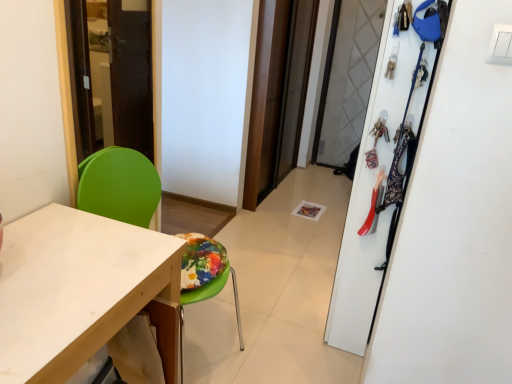
Question: Is white matte desk at lower left placed right next to white matte closet at upper right?

Choices:
 (A) no
 (B) yes

Answer: (A)

Question: From a real-world perspective, is white matte desk at lower left under white matte closet at upper right?

Choices:
 (A) yes
 (B) no

Answer: (A)

Question: Considering the relative positions of white matte desk at lower left and white matte closet at upper right in the image provided, is white matte desk at lower left to the left of white matte closet at upper right from the viewer's perspective?

Choices:
 (A) no
 (B) yes

Answer: (B)

Question: Considering the relative sizes of white matte desk at lower left and white matte closet at upper right in the image provided, is white matte desk at lower left thinner than white matte closet at upper right?

Choices:
 (A) no
 (B) yes

Answer: (A)

Question: Could you tell me if white matte desk at lower left is facing white matte closet at upper right?

Choices:
 (A) no
 (B) yes

Answer: (A)

Question: Looking at their shapes, would you say green plastic chair at left is wider or thinner than white matte closet at upper right?

Choices:
 (A) wide
 (B) thin

Answer: (A)

Question: Is point (140, 188) closer or farther from the camera than point (377, 148)?

Choices:
 (A) closer
 (B) farther

Answer: (B)

Question: From their relative heights in the image, would you say green plastic chair at left is taller or shorter than white matte closet at upper right?

Choices:
 (A) short
 (B) tall

Answer: (A)

Question: In the image, is green plastic chair at left positioned in front of or behind white matte closet at upper right?

Choices:
 (A) front
 (B) behind

Answer: (A)

Question: Is white matte closet at upper right in front of or behind transparent glass screen door at center in the image?

Choices:
 (A) front
 (B) behind

Answer: (A)

Question: From a real-world perspective, is white matte closet at upper right above or below transparent glass screen door at center?

Choices:
 (A) below
 (B) above

Answer: (A)

Question: Is white matte closet at upper right situated inside transparent glass screen door at center or outside?

Choices:
 (A) inside
 (B) outside

Answer: (B)

Question: From the image's perspective, is white matte closet at upper right located above or below transparent glass screen door at center?

Choices:
 (A) above
 (B) below

Answer: (B)

Question: Considering the positions of green plastic chair at left and transparent glass screen door at center in the image, is green plastic chair at left bigger or smaller than transparent glass screen door at center?

Choices:
 (A) big
 (B) small

Answer: (A)

Question: In the image, is green plastic chair at left on the left side or the right side of transparent glass screen door at center?

Choices:
 (A) right
 (B) left

Answer: (B)